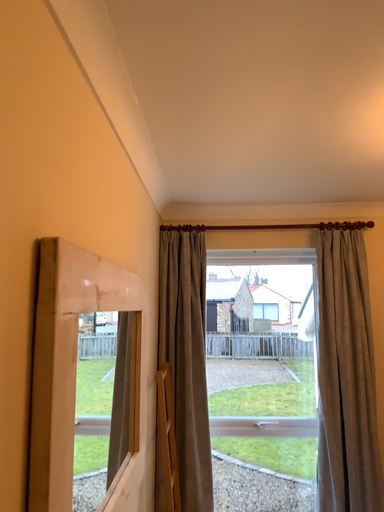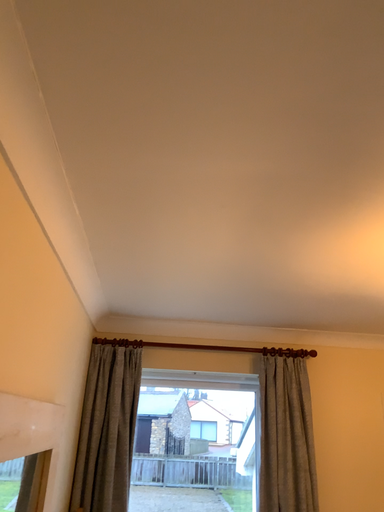
Question: How did the camera likely rotate when shooting the video?

Choices:
 (A) rotated right
 (B) rotated left

Answer: (A)